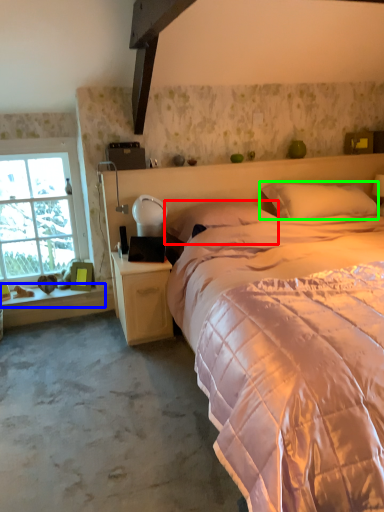
Question: Which object is positioned closest to pillow (highlighted by a red box)? Select from window sill (highlighted by a blue box) and pillow (highlighted by a green box).

Choices:
 (A) window sill
 (B) pillow

Answer: (B)